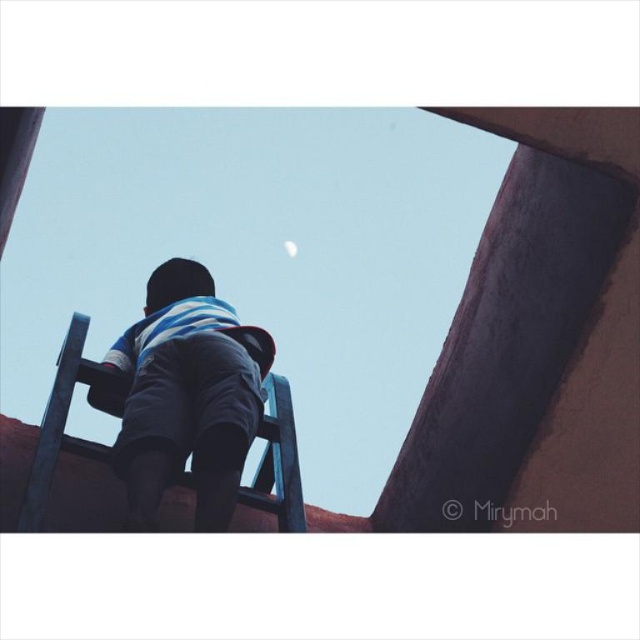
Question: Which of the following is the closest to the observer?

Choices:
 (A) blue striped shirt at center
 (B) white glossy moon at upper center

Answer: (A)

Question: Is blue striped shirt at center thinner than white glossy moon at upper center?

Choices:
 (A) no
 (B) yes

Answer: (B)

Question: Is blue striped shirt at center above white glossy moon at upper center?

Choices:
 (A) no
 (B) yes

Answer: (A)

Question: Does blue striped shirt at center have a greater width compared to white glossy moon at upper center?

Choices:
 (A) no
 (B) yes

Answer: (A)